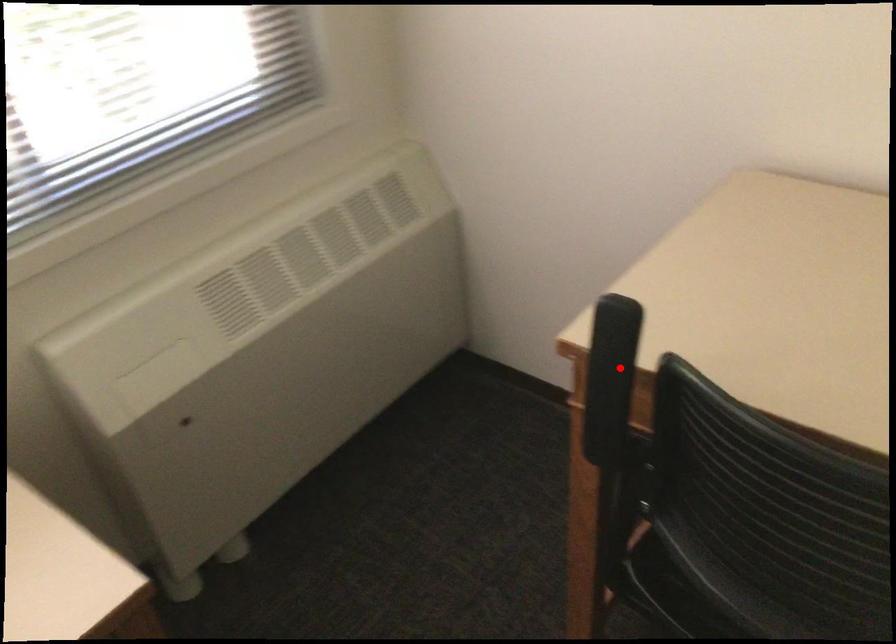
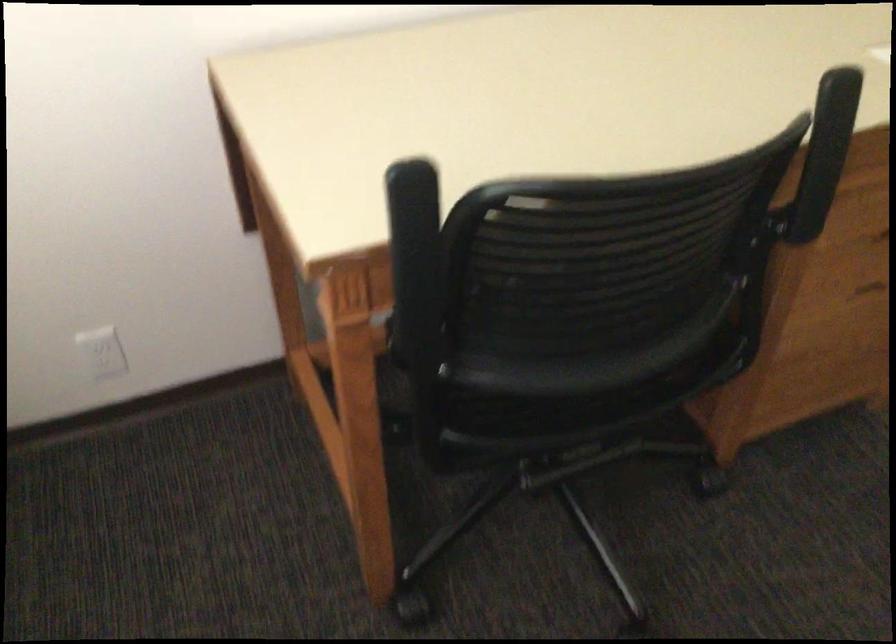
Where in the second image is the point corresponding to the highlighted location from the first image?

(414, 238)